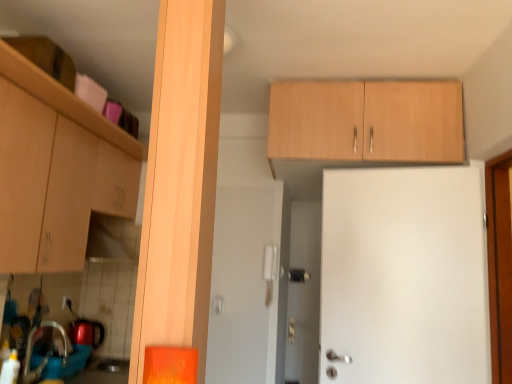
What is the approximate height of matte wood cabinet at left, acting as the first cabinetry starting from the left?

It is 29.55 inches.

Image resolution: width=512 pixels, height=384 pixels. Identify the location of matte wood cabinet at left, the 2th cabinetry from the right. (56, 170).

Considering the relative positions of white plastic electric outlet at lower left and matte wood cabinet at left, acting as the first cabinetry starting from the left, in the image provided, is white plastic electric outlet at lower left to the left or to the right of matte wood cabinet at left, acting as the first cabinetry starting from the left,?

From the image, it's evident that white plastic electric outlet at lower left is to the left of matte wood cabinet at left, acting as the first cabinetry starting from the left.

From the image's perspective, is white plastic electric outlet at lower left positioned above or below matte wood cabinet at left, acting as the first cabinetry starting from the left?

white plastic electric outlet at lower left is below matte wood cabinet at left, acting as the first cabinetry starting from the left.

Is white plastic electric outlet at lower left with matte wood cabinet at left, the 2th cabinetry from the right?

No, white plastic electric outlet at lower left is not next to matte wood cabinet at left, the 2th cabinetry from the right.

Is white plastic electric outlet at lower left taller or shorter than matte wood cabinet at left, the 2th cabinetry from the right?

Considering their sizes, white plastic electric outlet at lower left has less height than matte wood cabinet at left, the 2th cabinetry from the right.

Does brushed metal sink at lower left have a greater width compared to white plastic electric outlet at lower left?

Correct, the width of brushed metal sink at lower left exceeds that of white plastic electric outlet at lower left.

From the picture: Is brushed metal sink at lower left facing away from white plastic electric outlet at lower left?

That's not correct — brushed metal sink at lower left is not looking away from white plastic electric outlet at lower left.

Is brushed metal sink at lower left beside white plastic electric outlet at lower left?

No, brushed metal sink at lower left is not making contact with white plastic electric outlet at lower left.

Is brushed metal sink at lower left situated inside white plastic electric outlet at lower left or outside?

brushed metal sink at lower left is not enclosed by white plastic electric outlet at lower left.

Which object is wider, white plastic electric outlet at lower left or brushed metal sink at lower left?

Wider between the two is brushed metal sink at lower left.

From the picture: Does white plastic electric outlet at lower left have a smaller size compared to brushed metal sink at lower left?

Indeed, white plastic electric outlet at lower left has a smaller size compared to brushed metal sink at lower left.

Are white plastic electric outlet at lower left and brushed metal sink at lower left making contact?

No, white plastic electric outlet at lower left is not with brushed metal sink at lower left.

Looking at their sizes, would you say matte wood cabinet at left, acting as the first cabinetry starting from the left, is wider or thinner than brushed metal sink at lower left?

matte wood cabinet at left, acting as the first cabinetry starting from the left, is wider than brushed metal sink at lower left.

Looking at this image, does matte wood cabinet at left, the 2th cabinetry from the right, have a larger size compared to brushed metal sink at lower left?

Yes, matte wood cabinet at left, the 2th cabinetry from the right, is bigger than brushed metal sink at lower left.

Is matte wood cabinet at left, the 2th cabinetry from the right, inside or outside of brushed metal sink at lower left?

matte wood cabinet at left, the 2th cabinetry from the right, is not enclosed by brushed metal sink at lower left.

What's the angular difference between matte wood cabinet at left, the 2th cabinetry from the right, and brushed metal sink at lower left's facing directions?

0.705 degrees.

Consider the image. Between matte wood cabinet at left, the 2th cabinetry from the right, and white plastic electric outlet at lower left, which one is positioned behind?

white plastic electric outlet at lower left is further away from the camera.

From the image's perspective, is matte wood cabinet at left, acting as the first cabinetry starting from the left, positioned above or below white plastic electric outlet at lower left?

matte wood cabinet at left, acting as the first cabinetry starting from the left, is situated higher than white plastic electric outlet at lower left in the image.

Would you say matte wood cabinet at left, the 2th cabinetry from the right, is inside or outside white plastic electric outlet at lower left?

matte wood cabinet at left, the 2th cabinetry from the right, exists outside the volume of white plastic electric outlet at lower left.

Considering the relative sizes of matte wood cabinet at left, the 2th cabinetry from the right, and white plastic electric outlet at lower left in the image provided, is matte wood cabinet at left, the 2th cabinetry from the right, shorter than white plastic electric outlet at lower left?

No.

From the picture: How many degrees apart are the facing directions of white plastic electric outlet at lower left and light wood cabinet at upper center, marked as the 2th cabinetry in a left-to-right arrangement?

They differ by 88.5 degrees in their facing directions.

Is there a large distance between white plastic electric outlet at lower left and light wood cabinet at upper center, arranged as the 1th cabinetry when viewed from the right?

Yes, white plastic electric outlet at lower left is far from light wood cabinet at upper center, arranged as the 1th cabinetry when viewed from the right.

In the scene shown: Considering the sizes of objects white plastic electric outlet at lower left and light wood cabinet at upper center, marked as the 2th cabinetry in a left-to-right arrangement, in the image provided, who is bigger, white plastic electric outlet at lower left or light wood cabinet at upper center, marked as the 2th cabinetry in a left-to-right arrangement,?

light wood cabinet at upper center, marked as the 2th cabinetry in a left-to-right arrangement.

Can we say white plastic electric outlet at lower left lies outside light wood cabinet at upper center, marked as the 2th cabinetry in a left-to-right arrangement?

Yes, white plastic electric outlet at lower left is not within light wood cabinet at upper center, marked as the 2th cabinetry in a left-to-right arrangement.

Does light wood cabinet at upper center, arranged as the 1th cabinetry when viewed from the right, appear on the left side of white plastic electric outlet at lower left?

No, light wood cabinet at upper center, arranged as the 1th cabinetry when viewed from the right, is not to the left of white plastic electric outlet at lower left.

In the image, is light wood cabinet at upper center, arranged as the 1th cabinetry when viewed from the right, positioned in front of or behind white plastic electric outlet at lower left?

In the image, light wood cabinet at upper center, arranged as the 1th cabinetry when viewed from the right, appears in front of white plastic electric outlet at lower left.

From the image's perspective, between light wood cabinet at upper center, arranged as the 1th cabinetry when viewed from the right, and white plastic electric outlet at lower left, which one is located above?

From the image's view, light wood cabinet at upper center, arranged as the 1th cabinetry when viewed from the right, is above.

Would you say light wood cabinet at upper center, marked as the 2th cabinetry in a left-to-right arrangement, is inside or outside white plastic electric outlet at lower left?

light wood cabinet at upper center, marked as the 2th cabinetry in a left-to-right arrangement, is spatially situated outside white plastic electric outlet at lower left.

This screenshot has height=384, width=512. Identify the location of electric outlet lying on the left of matte wood cabinet at left, the 2th cabinetry from the right. (67, 303).

Where is `sink in front of the white plastic electric outlet at lower left`? The width and height of the screenshot is (512, 384). sink in front of the white plastic electric outlet at lower left is located at coordinates (54, 357).

Which object lies nearer to the anchor point matte wood cabinet at left, the 2th cabinetry from the right, white plastic electric outlet at lower left or brushed metal sink at lower left?

brushed metal sink at lower left is positioned closer to the anchor matte wood cabinet at left, the 2th cabinetry from the right.

Considering their positions, is brushed metal sink at lower left positioned closer to light wood cabinet at upper center, marked as the 2th cabinetry in a left-to-right arrangement, than white plastic electric outlet at lower left?

The object closer to light wood cabinet at upper center, marked as the 2th cabinetry in a left-to-right arrangement, is brushed metal sink at lower left.

When comparing their distances from white plastic electric outlet at lower left, does matte wood cabinet at left, the 2th cabinetry from the right, or brushed metal sink at lower left seem further?

Among the two, matte wood cabinet at left, the 2th cabinetry from the right, is located further to white plastic electric outlet at lower left.

Estimate the real-world distances between objects in this image. Which object is further from brushed metal sink at lower left, matte wood cabinet at left, acting as the first cabinetry starting from the left, or light wood cabinet at upper center, marked as the 2th cabinetry in a left-to-right arrangement?

light wood cabinet at upper center, marked as the 2th cabinetry in a left-to-right arrangement, lies further to brushed metal sink at lower left than the other object.

Estimate the real-world distances between objects in this image. Which object is closer to matte wood cabinet at left, the 2th cabinetry from the right, white plastic electric outlet at lower left or light wood cabinet at upper center, marked as the 2th cabinetry in a left-to-right arrangement?

Among the two, white plastic electric outlet at lower left is located nearer to matte wood cabinet at left, the 2th cabinetry from the right.

Estimate the real-world distances between objects in this image. Which object is further from matte wood cabinet at left, acting as the first cabinetry starting from the left, brushed metal sink at lower left or light wood cabinet at upper center, arranged as the 1th cabinetry when viewed from the right?

light wood cabinet at upper center, arranged as the 1th cabinetry when viewed from the right, lies further to matte wood cabinet at left, acting as the first cabinetry starting from the left, than the other object.

Estimate the real-world distances between objects in this image. Which object is further from matte wood cabinet at left, acting as the first cabinetry starting from the left, light wood cabinet at upper center, marked as the 2th cabinetry in a left-to-right arrangement, or white plastic electric outlet at lower left?

Among the two, light wood cabinet at upper center, marked as the 2th cabinetry in a left-to-right arrangement, is located further to matte wood cabinet at left, acting as the first cabinetry starting from the left.

Considering their positions, is matte wood cabinet at left, the 2th cabinetry from the right, positioned further to white plastic electric outlet at lower left than light wood cabinet at upper center, arranged as the 1th cabinetry when viewed from the right?

light wood cabinet at upper center, arranged as the 1th cabinetry when viewed from the right, lies further to white plastic electric outlet at lower left than the other object.

Identify the location of sink between matte wood cabinet at left, acting as the first cabinetry starting from the left, and white plastic electric outlet at lower left from front to back. (54, 357).

Locate an element on the screen. This screenshot has width=512, height=384. sink situated between white plastic electric outlet at lower left and light wood cabinet at upper center, arranged as the 1th cabinetry when viewed from the right, from left to right is located at coordinates (54, 357).

Image resolution: width=512 pixels, height=384 pixels. In order to click on sink between matte wood cabinet at left, the 2th cabinetry from the right, and light wood cabinet at upper center, arranged as the 1th cabinetry when viewed from the right in this screenshot , I will do `click(54, 357)`.

You are a GUI agent. You are given a task and a screenshot of the screen. Output one action in this format:
    pyautogui.click(x=<x>, y=<y>)
    Task: Click on the cabinetry located between white plastic electric outlet at lower left and light wood cabinet at upper center, marked as the 2th cabinetry in a left-to-right arrangement, in the left-right direction
    
    Given the screenshot: What is the action you would take?
    pyautogui.click(x=56, y=170)